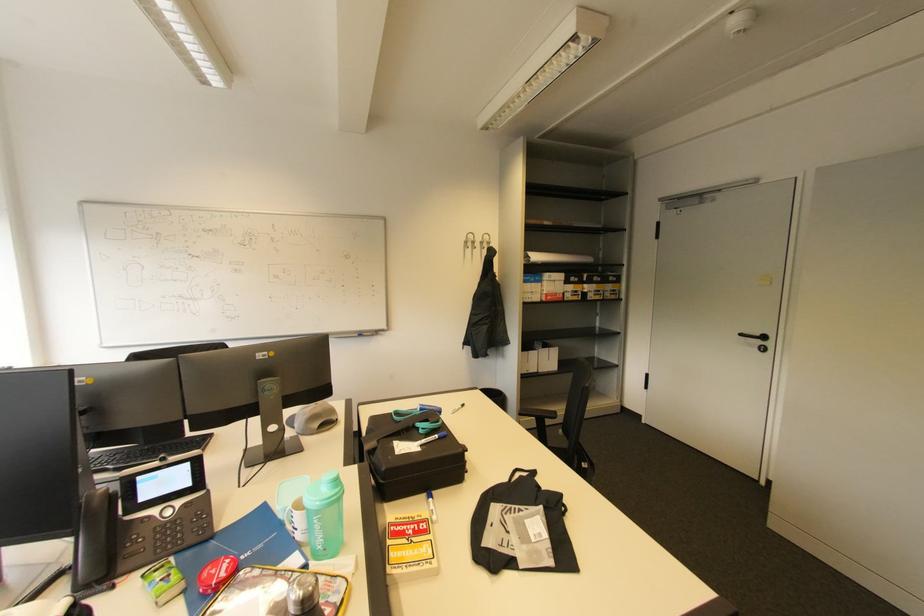
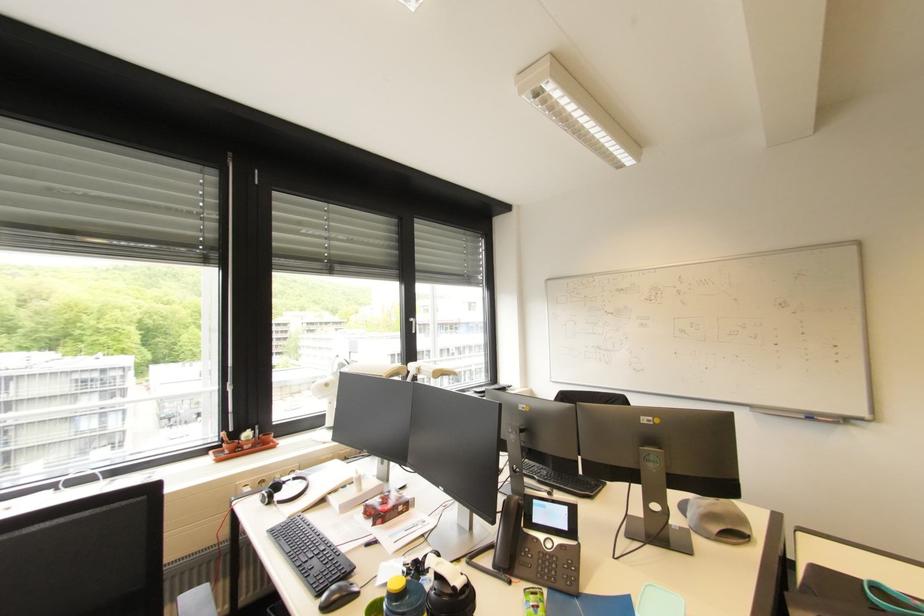
Where in the second image is the point corresponding to the point at 192,464 from the first image?

(572, 509)